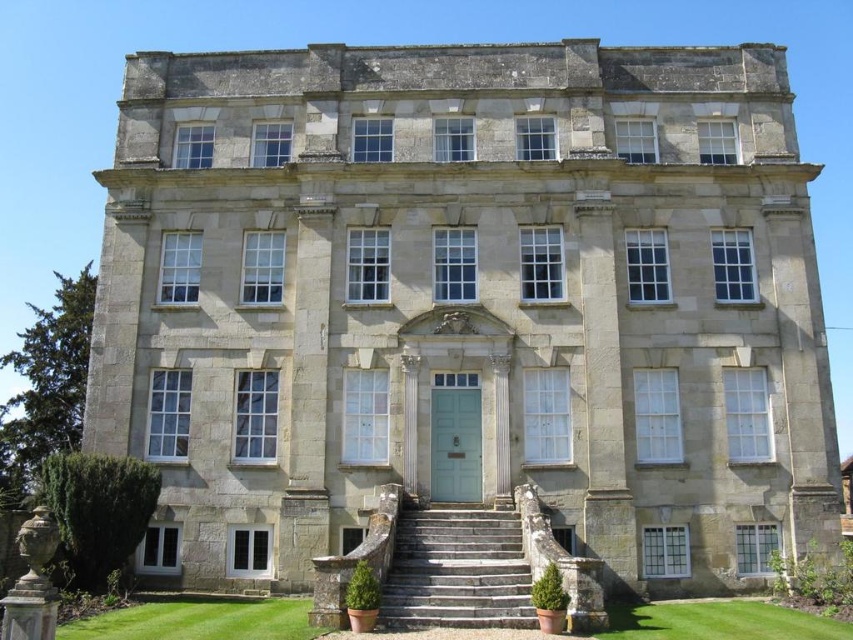
Can you confirm if stone steps at center is bigger than green grass at lower right?

Incorrect, stone steps at center is not larger than green grass at lower right.

Which is behind, point (410, 579) or point (751, 632)?

The point (410, 579) is more distant.

Where is `stone steps at center`? The width and height of the screenshot is (853, 640). stone steps at center is located at coordinates (456, 572).

Does stone steps at center have a greater height compared to green grass at lower center?

Yes.

Who is lower down, stone steps at center or green grass at lower center?

green grass at lower center is lower down.

Does point (430, 566) come in front of point (302, 608)?

Yes, it is in front of point (302, 608).

Find the location of a particular element. The image size is (853, 640). stone steps at center is located at coordinates (456, 572).

Looking at this image, can you confirm if green grass at lower center is positioned above green grass at lower right?

Incorrect, green grass at lower center is not positioned above green grass at lower right.

Who is lower down, green grass at lower center or green grass at lower right?

green grass at lower center is lower down.

Locate an element on the screen. green grass at lower center is located at coordinates (196, 620).

In order to click on green grass at lower center in this screenshot , I will do `click(196, 620)`.